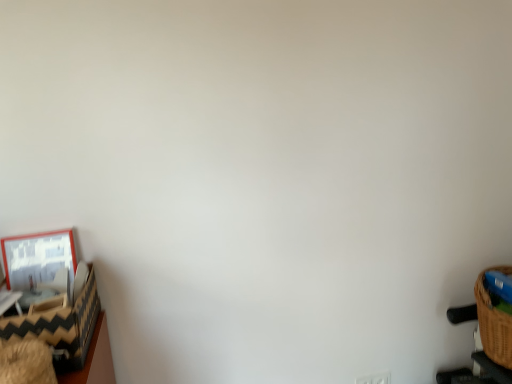
Question: Does matte wooden picture frame at left turn towards black and white zigzag-patterned basket at left?

Choices:
 (A) yes
 (B) no

Answer: (A)

Question: Considering the relative positions of matte wooden picture frame at left and black and white zigzag-patterned basket at left in the image provided, is matte wooden picture frame at left to the left of black and white zigzag-patterned basket at left from the viewer's perspective?

Choices:
 (A) no
 (B) yes

Answer: (B)

Question: Is matte wooden picture frame at left in contact with black and white zigzag-patterned basket at left?

Choices:
 (A) yes
 (B) no

Answer: (B)

Question: Is matte wooden picture frame at left to the right of black and white zigzag-patterned basket at left from the viewer's perspective?

Choices:
 (A) no
 (B) yes

Answer: (A)

Question: Is matte wooden picture frame at left further to camera compared to black and white zigzag-patterned basket at left?

Choices:
 (A) yes
 (B) no

Answer: (A)

Question: Does point (358, 379) appear closer or farther from the camera than point (80, 349)?

Choices:
 (A) farther
 (B) closer

Answer: (A)

Question: From the image's perspective, is white plastic electric outlet at lower right located above or below black and white zigzag-patterned basket at left?

Choices:
 (A) above
 (B) below

Answer: (B)

Question: Is white plastic electric outlet at lower right wider or thinner than black and white zigzag-patterned basket at left?

Choices:
 (A) wide
 (B) thin

Answer: (B)

Question: Relative to black and white zigzag-patterned basket at left, is white plastic electric outlet at lower right in front or behind?

Choices:
 (A) front
 (B) behind

Answer: (B)

Question: Would you say matte wooden picture frame at left is to the left or to the right of black and white zigzag-patterned basket at left in the picture?

Choices:
 (A) left
 (B) right

Answer: (A)

Question: Relative to black and white zigzag-patterned basket at left, is matte wooden picture frame at left in front or behind?

Choices:
 (A) behind
 (B) front

Answer: (A)

Question: Does point (52, 286) appear closer or farther from the camera than point (35, 334)?

Choices:
 (A) farther
 (B) closer

Answer: (A)

Question: Is matte wooden picture frame at left spatially inside black and white zigzag-patterned basket at left, or outside of it?

Choices:
 (A) inside
 (B) outside

Answer: (B)

Question: From a real-world perspective, is black and white zigzag-patterned basket at left above or below matte wooden picture frame at left?

Choices:
 (A) below
 (B) above

Answer: (A)

Question: Relative to matte wooden picture frame at left, is black and white zigzag-patterned basket at left in front or behind?

Choices:
 (A) behind
 (B) front

Answer: (B)